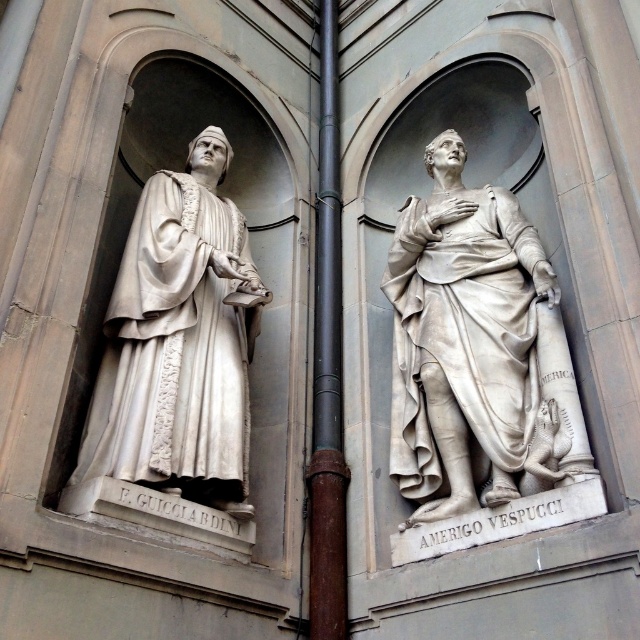
You are an architect inspecting the building facade. You notice the white marble statue at center and the brown metal pipe at center. Which object is closer to you?

The white marble statue at center is closer to you because it is in front of the brown metal pipe at center.

You are a maintenance worker inspecting the building facade. You notice the white marble statue at left and the brown metal pipe at center. Which object is located above the other?

The brown metal pipe at center is above the white marble statue at left because the statue is positioned under the pipe.

Based on the photo, you are an architect inspecting the building facade. You need to install a new lighting fixture that must be placed above the taller object between the white marble statue at left and the brown metal pipe at center. Which object should the light be positioned above?

The brown metal pipe at center is taller than the white marble statue at left, so the light should be positioned above the brown metal pipe at center.